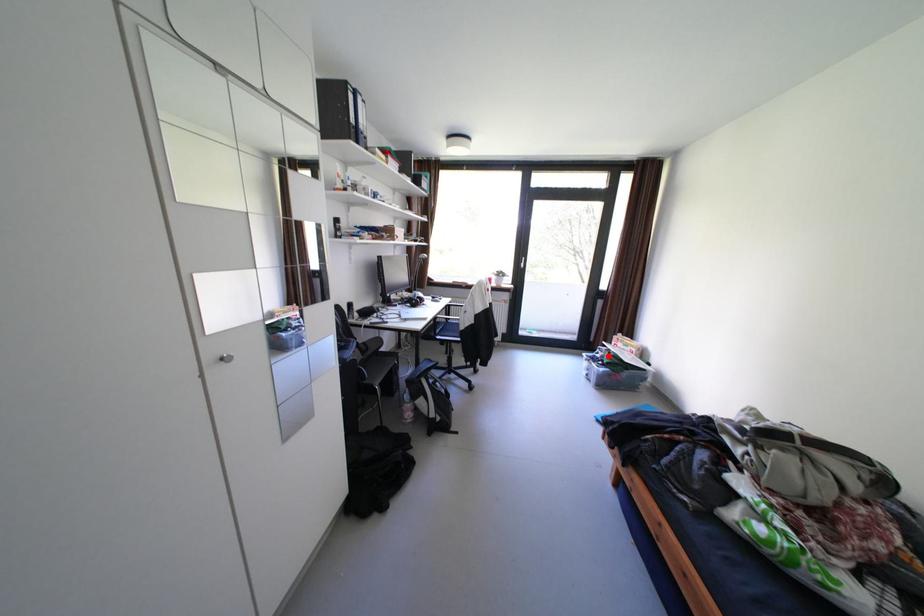
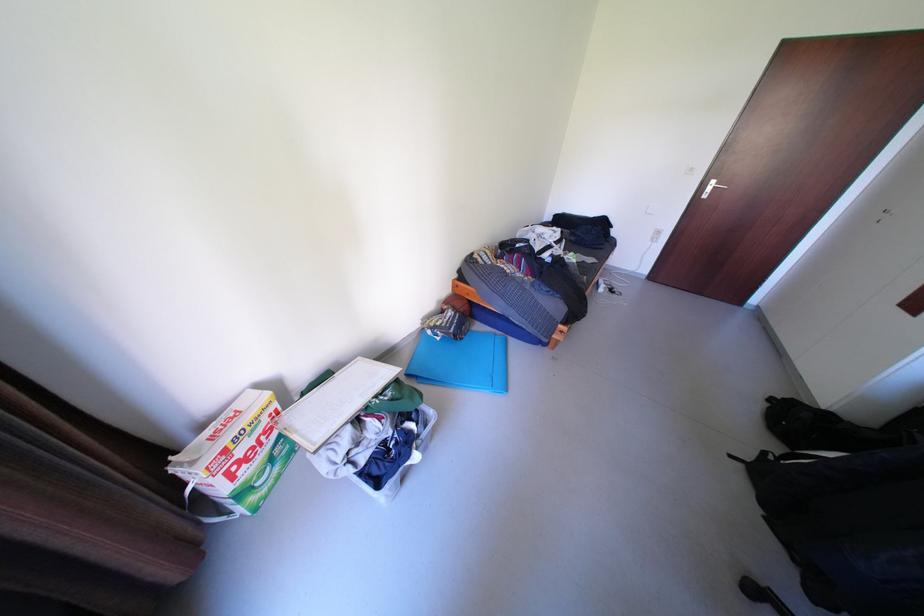
Question: I am providing you with two images of the same scene from different viewpoints. Image1 has a red point marked. In image2, the corresponding 3D location appears at what relative position? Reply with the corresponding letter.

Choices:
 (A) Closer
 (B) Farther

Answer: (B)